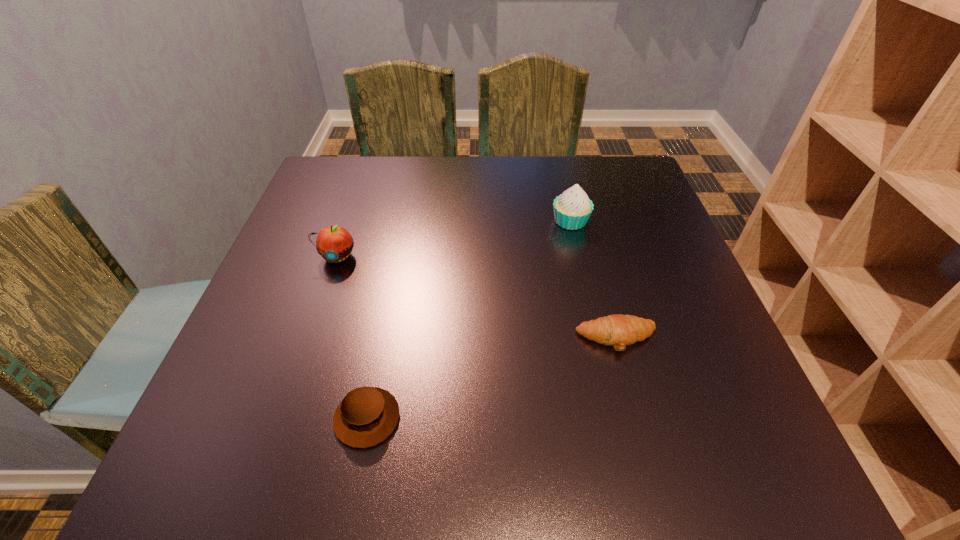
The image size is (960, 540). I want to click on object that ranks as the second closest to the tallest object, so click(x=334, y=243).

Locate an element on the screen. object that can be found as the second closest to the second shortest object is located at coordinates (619, 330).

This screenshot has height=540, width=960. I want to click on free space in the image that satisfies the following two spatial constraints: 1. on the front side of the third object from right to left; 2. on the left side of the apple, so click(x=282, y=418).

The width and height of the screenshot is (960, 540). Find the location of `free location that satisfies the following two spatial constraints: 1. on the front side of the third shortest object; 2. on the left side of the shortest object`. free location that satisfies the following two spatial constraints: 1. on the front side of the third shortest object; 2. on the left side of the shortest object is located at coordinates (309, 339).

The height and width of the screenshot is (540, 960). Identify the location of free spot that satisfies the following two spatial constraints: 1. on the front side of the cupcake; 2. on the right side of the second nearest object. (598, 339).

I want to click on blank area in the image that satisfies the following two spatial constraints: 1. on the front side of the third nearest object; 2. on the right side of the third tallest object, so click(282, 418).

Identify the location of free spot that satisfies the following two spatial constraints: 1. on the front side of the apple; 2. on the right side of the third object from right to left. (282, 418).